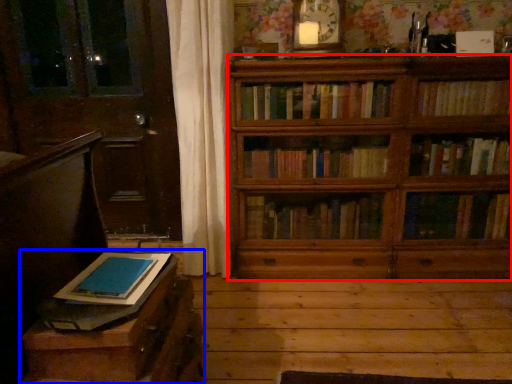
Question: Among these objects, which one is nearest to the camera, bookcase (highlighted by a red box) or table (highlighted by a blue box)?

Choices:
 (A) bookcase
 (B) table

Answer: (B)